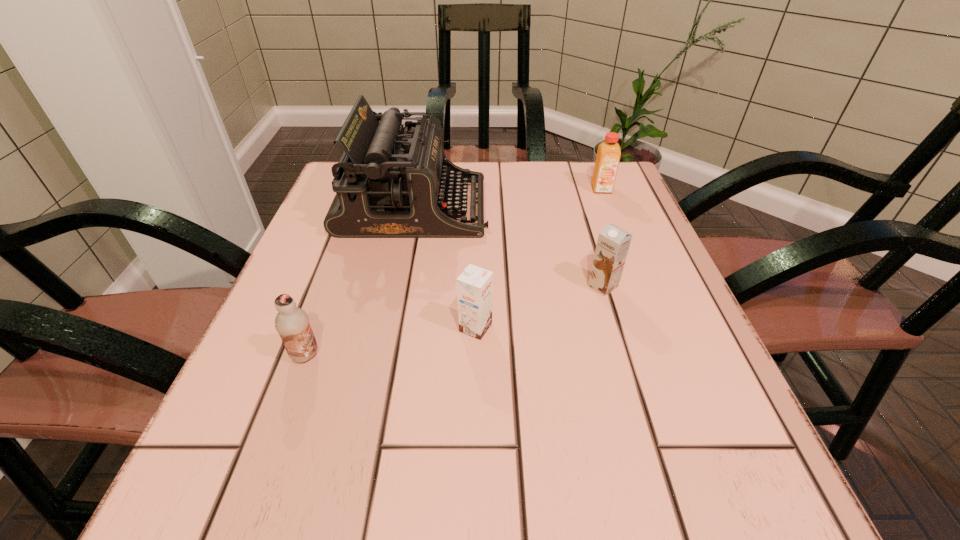
You are a GUI agent. You are given a task and a screenshot of the screen. Output one action in this format:
    pyautogui.click(x=<x>, y=<y>)
    Task: Click on the free space between the tallest object and the fourth object from left to right
    
    Given the screenshot: What is the action you would take?
    pyautogui.click(x=509, y=246)

Identify the location of vacant area that lies between the typewriter and the fourth object from left to right. Image resolution: width=960 pixels, height=540 pixels. (509, 246).

I want to click on free area in between the tallest object and the leftmost chocolate milk, so click(x=360, y=281).

Locate an element on the screen. Image resolution: width=960 pixels, height=540 pixels. blank region between the rightmost object and the second chocolate milk from left to right is located at coordinates [x=539, y=258].

Locate an element on the screen. free space that is in between the second nearest chocolate milk and the rightmost object is located at coordinates (539, 258).

Image resolution: width=960 pixels, height=540 pixels. I want to click on object that is the fourth closest to the fourth farthest object, so click(x=608, y=155).

Locate which object ranks in proximity to the nearest chocolate milk. Please provide its 2D coordinates. Your answer should be formatted as a tuple, i.e. [(x, y)], where the tuple contains the x and y coordinates of a point satisfying the conditions above.

[(475, 285)]

The height and width of the screenshot is (540, 960). Find the location of `chocolate milk that is the closest to the rightmost object`. chocolate milk that is the closest to the rightmost object is located at coordinates (613, 243).

Choose which chocolate milk is the second nearest neighbor to the second nearest object. Please provide its 2D coordinates. Your answer should be formatted as a tuple, i.e. [(x, y)], where the tuple contains the x and y coordinates of a point satisfying the conditions above.

[(292, 323)]

Where is `free location that satisfies the following two spatial constraints: 1. on the back side of the farthest chocolate milk; 2. on the right side of the second chocolate milk from right to left`? The image size is (960, 540). free location that satisfies the following two spatial constraints: 1. on the back side of the farthest chocolate milk; 2. on the right side of the second chocolate milk from right to left is located at coordinates (476, 286).